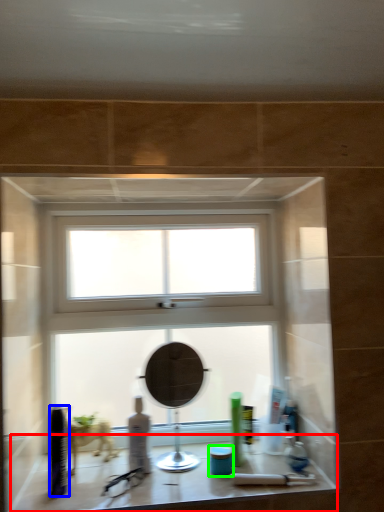
Question: Based on their relative distances, which object is farther from counter top (highlighted by a red box)? Choose from toiletry (highlighted by a blue box) and toiletry (highlighted by a green box).

Choices:
 (A) toiletry
 (B) toiletry

Answer: (B)